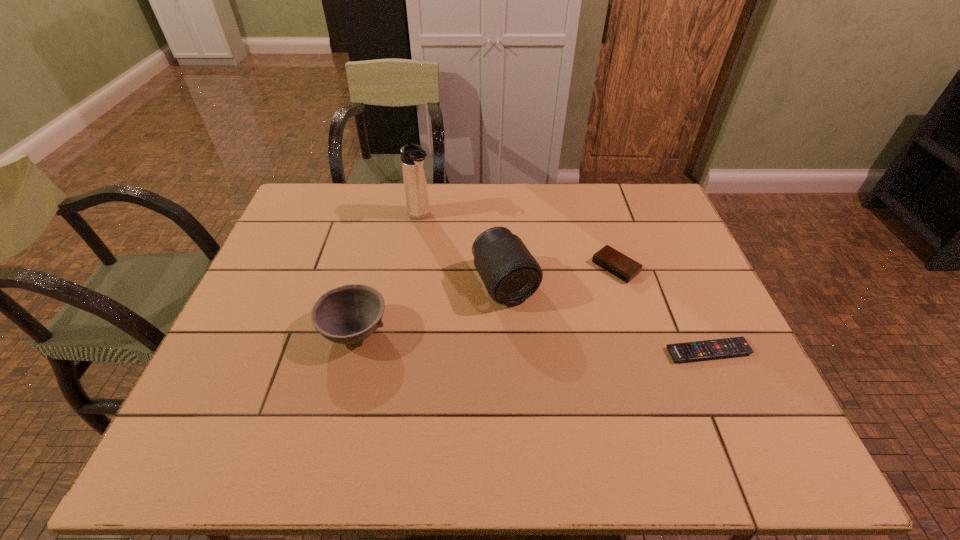
Identify the location of vacant region between the remote control and the alarm clock. (661, 309).

Where is `free space between the third object from right to left and the thermos bottle`? free space between the third object from right to left and the thermos bottle is located at coordinates (463, 250).

Locate an element on the screen. The height and width of the screenshot is (540, 960). vacant space that's between the telephoto lens and the alarm clock is located at coordinates (561, 275).

Where is `the second closest object relative to the tallest object`? the second closest object relative to the tallest object is located at coordinates (348, 314).

Locate which object is the fourth closest to the second shortest object. Please provide its 2D coordinates. Your answer should be formatted as a tuple, i.e. [(x, y)], where the tuple contains the x and y coordinates of a point satisfying the conditions above.

[(348, 314)]

Image resolution: width=960 pixels, height=540 pixels. What are the coordinates of `free spot that satisfies the following two spatial constraints: 1. on the back side of the third tallest object; 2. on the right side of the fourth shortest object` in the screenshot? It's located at (367, 284).

Identify the location of free location that satisfies the following two spatial constraints: 1. on the back side of the second shortest object; 2. on the right side of the bowl. Image resolution: width=960 pixels, height=540 pixels. (371, 267).

This screenshot has width=960, height=540. I want to click on vacant region that satisfies the following two spatial constraints: 1. on the front side of the second tallest object; 2. on the right side of the farthest object, so click(x=410, y=284).